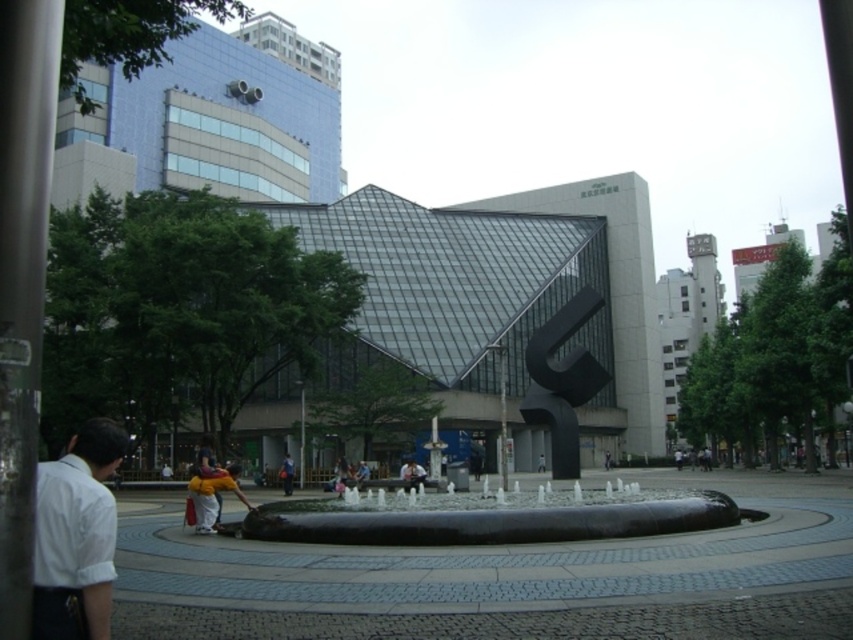
You are standing at the entrance of the plaza and want to locate the black polished water feature at center. According to the coordinates provided, in which direction should you walk to reach it?

The black polished water feature at center is located at point 0.811 on the x axis and 0.574 on the y axis. Since you are at the entrance, you should walk towards the right and slightly forward to reach it.

You are standing in the plaza and want to take a photo of the yellow fabric jacket at center without the black polished water feature at center blocking the view. Is this possible?

The black polished water feature at center is closer to the viewer than the yellow fabric jacket at center, so it will block the view of the jacket. Move closer to the jacket to ensure the water feature is not in front of it.